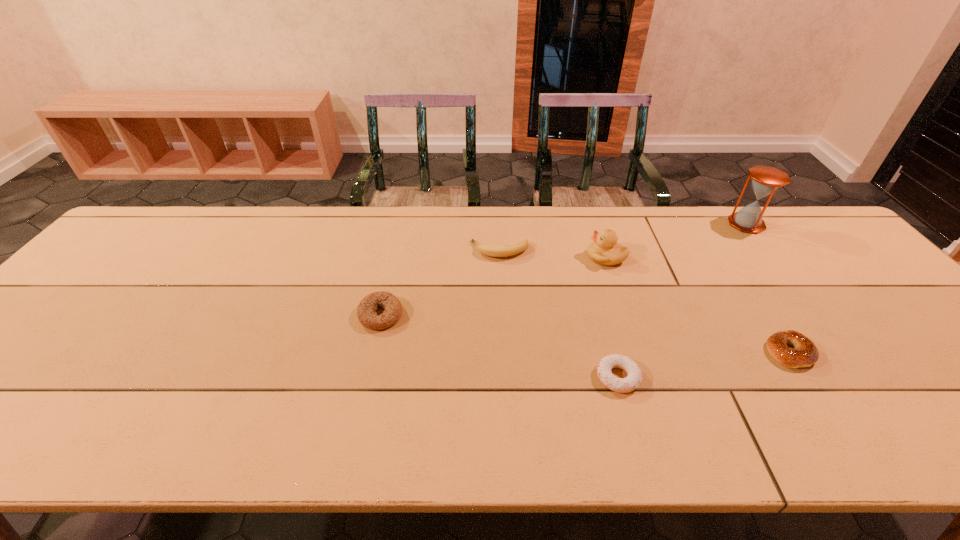
Find the location of a particular element. This screenshot has height=540, width=960. vacant area situated 0.180m on the beak of the duckling is located at coordinates (524, 257).

Where is `vacant space situated 0.200m on the beak of the duckling`? The image size is (960, 540). vacant space situated 0.200m on the beak of the duckling is located at coordinates (517, 257).

Where is `vacant space located 0.120m on the beak of the duckling`? vacant space located 0.120m on the beak of the duckling is located at coordinates (545, 257).

I want to click on vacant region located 0.230m at the stem of the second object from left to right, so click(393, 251).

What are the coordinates of `free space located 0.320m at the stem of the second object from left to right` in the screenshot? It's located at (362, 251).

At what (x,y) coordinates should I click in order to perform the action: click on free space located 0.120m at the stem of the second object from left to right. Please return your answer as a coordinate pair (x, y). This screenshot has width=960, height=540. Looking at the image, I should click on (430, 251).

Identify the location of vacant space situated 0.080m on the left of the leftmost object. This screenshot has width=960, height=540. (326, 315).

Find the location of a particular element. This screenshot has width=960, height=540. vacant space situated 0.290m on the back of the nearer bagel is located at coordinates (728, 257).

You are a GUI agent. You are given a task and a screenshot of the screen. Output one action in this format:
    pyautogui.click(x=<x>, y=<y>)
    Task: Click on the free space located on the left of the doughnut
    
    Given the screenshot: What is the action you would take?
    [510, 377]

Image resolution: width=960 pixels, height=540 pixels. I want to click on hourglass that is positioned at the far edge, so click(x=766, y=180).